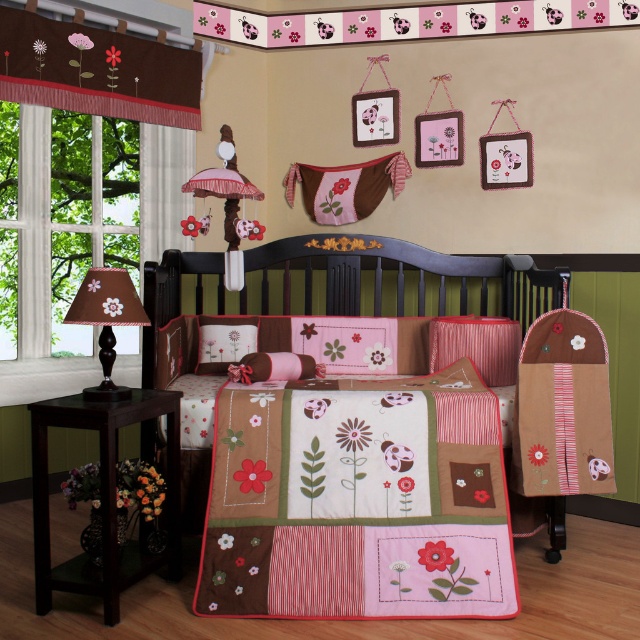
Question: Does patchwork quilt at center appear over floral fabric pillow at center?

Choices:
 (A) no
 (B) yes

Answer: (A)

Question: Which point is closer to the camera?

Choices:
 (A) brown fabric valance at upper left
 (B) pink fabric pillow at center
 (C) brown fabric lampshade at left

Answer: (C)

Question: Which point is farther to the camera?

Choices:
 (A) patchwork quilt at center
 (B) pink fabric pillow at center
 (C) floral fabric pillow at center

Answer: (C)

Question: Does patchwork quilt at center have a lesser width compared to brown fabric lampshade at left?

Choices:
 (A) no
 (B) yes

Answer: (A)

Question: Which is nearer to the brown fabric valance at upper left?

Choices:
 (A) brown fabric lampshade at left
 (B) floral fabric pillow at center
 (C) patchwork quilt at center

Answer: (B)

Question: Is brown fabric valance at upper left bigger than brown fabric lampshade at left?

Choices:
 (A) yes
 (B) no

Answer: (A)